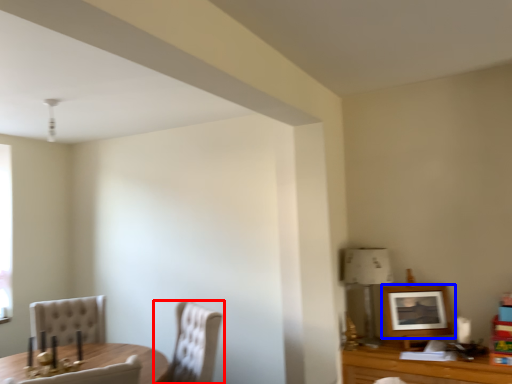
Question: Which point is closer to the camera, chair (highlighted by a red box) or picture frame (highlighted by a blue box)?

Choices:
 (A) chair
 (B) picture frame

Answer: (A)